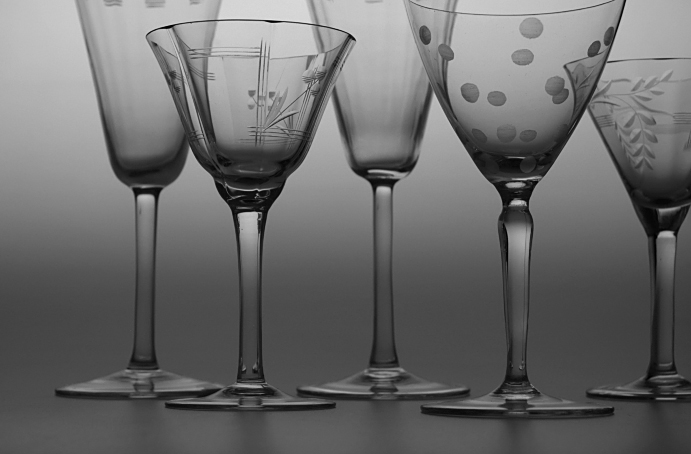
Locate an element on the screen. wine glasses is located at coordinates (117, 62), (243, 97), (361, 80), (464, 77), (618, 109).